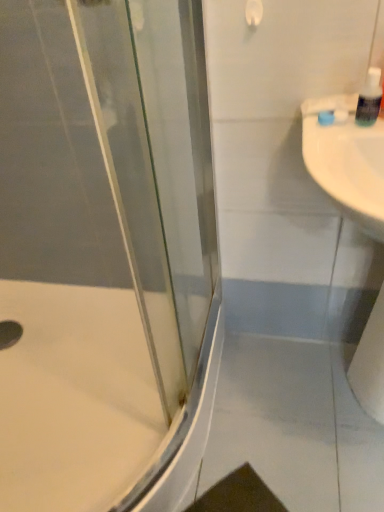
Question: Relative to transparent glass shower door at left, is white matte toilet paper at right in front or behind?

Choices:
 (A) front
 (B) behind

Answer: (B)

Question: Would you say white matte toilet paper at right is inside or outside transparent glass shower door at left?

Choices:
 (A) outside
 (B) inside

Answer: (A)

Question: Which object is the closest to the white glossy bath at lower left?

Choices:
 (A) transparent glass shower door at left
 (B) clear plastic soap dispenser at upper right
 (C) white glossy sink at right
 (D) white matte toilet paper at right

Answer: (A)

Question: Estimate the real-world distances between objects in this image. Which object is farther from the white glossy sink at right?

Choices:
 (A) transparent glass shower door at left
 (B) clear plastic soap dispenser at upper right
 (C) white glossy bath at lower left
 (D) white matte toilet paper at right

Answer: (C)